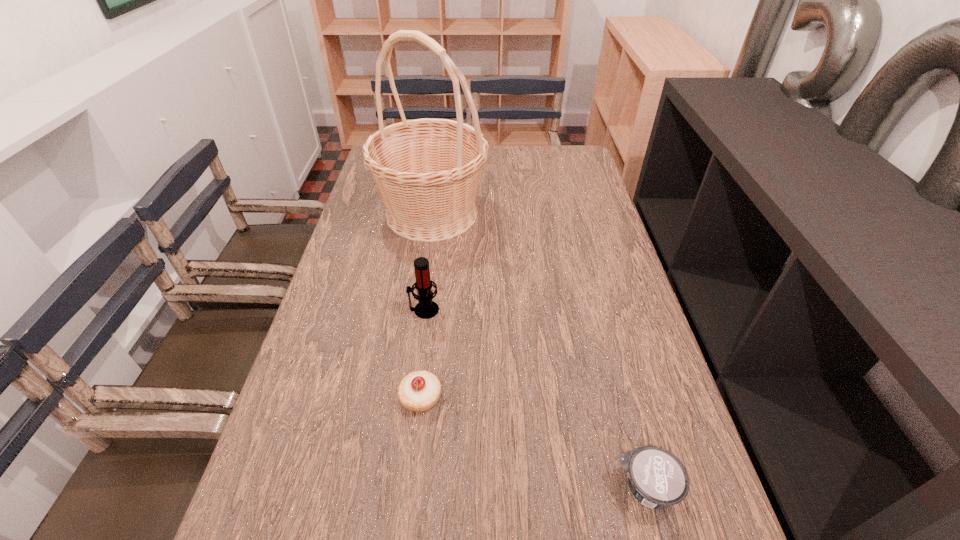
At what (x,y) coordinates should I click in order to perform the action: click on unoccupied position between the second nearest object and the nearest object. Please return your answer as a coordinate pair (x, y). Looking at the image, I should click on (534, 443).

Locate an element on the screen. This screenshot has width=960, height=540. vacant space that's between the nearest object and the basket is located at coordinates (540, 351).

Find the location of `vacant space that's between the rightmost object and the third nearest object`. vacant space that's between the rightmost object and the third nearest object is located at coordinates (536, 399).

What are the coordinates of `free area in between the yogurt and the second tallest object` in the screenshot? It's located at (536, 399).

Locate an element on the screen. Image resolution: width=960 pixels, height=540 pixels. object that can be found as the third closest to the second nearest object is located at coordinates (427, 171).

Identify which object is located as the second nearest to the pastry. Please provide its 2D coordinates. Your answer should be formatted as a tuple, i.e. [(x, y)], where the tuple contains the x and y coordinates of a point satisfying the conditions above.

[(657, 478)]